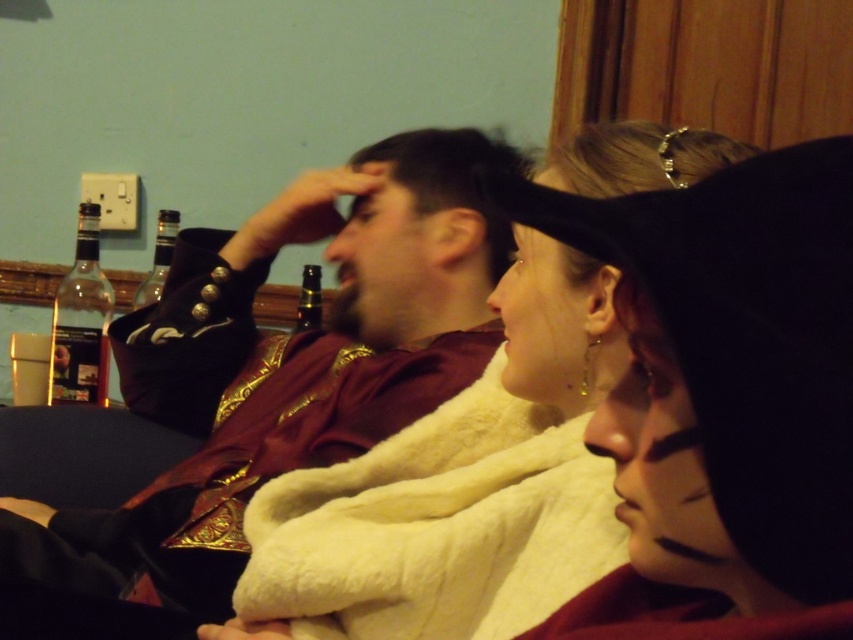
Question: Which point is closer to the camera?

Choices:
 (A) white fluffy blanket at center
 (B) white fluffy coat at center

Answer: (B)

Question: Which of the following is the farthest from the observer?

Choices:
 (A) velvet maroon robe at center
 (B) white fluffy blanket at center
 (C) black felt hat at upper center
 (D) white fluffy coat at center

Answer: (A)

Question: Does matte brown hair at center have a lesser width compared to black felt hat at upper center?

Choices:
 (A) yes
 (B) no

Answer: (B)

Question: Among these objects, which one is farthest from the camera?

Choices:
 (A) matte brown hair at center
 (B) white fluffy blanket at center
 (C) black felt hat at upper center

Answer: (A)

Question: Can you confirm if velvet maroon robe at center is thinner than white fluffy blanket at center?

Choices:
 (A) yes
 (B) no

Answer: (B)

Question: Where is white fluffy coat at center located in relation to black felt hat at upper center in the image?

Choices:
 (A) left
 (B) right

Answer: (A)